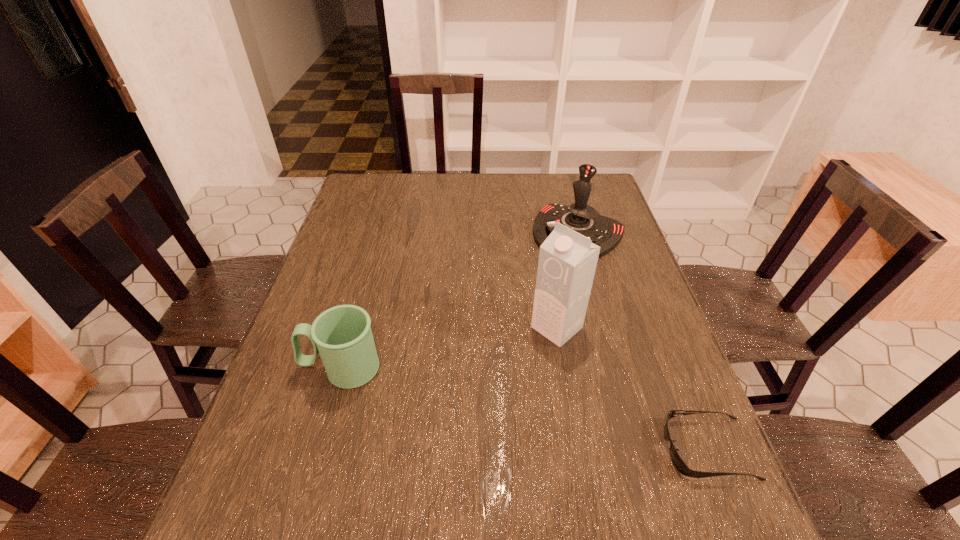
This screenshot has width=960, height=540. Find the location of `the third closest object to the farthest object`. the third closest object to the farthest object is located at coordinates click(342, 335).

The width and height of the screenshot is (960, 540). Identify the location of object that ranks as the third closest to the nearest object. (342, 335).

What are the coordinates of `vacant space that satisfies the following two spatial constraints: 1. on the front side of the sunglasses; 2. on the front-facing side of the third nearest object` in the screenshot? It's located at (578, 449).